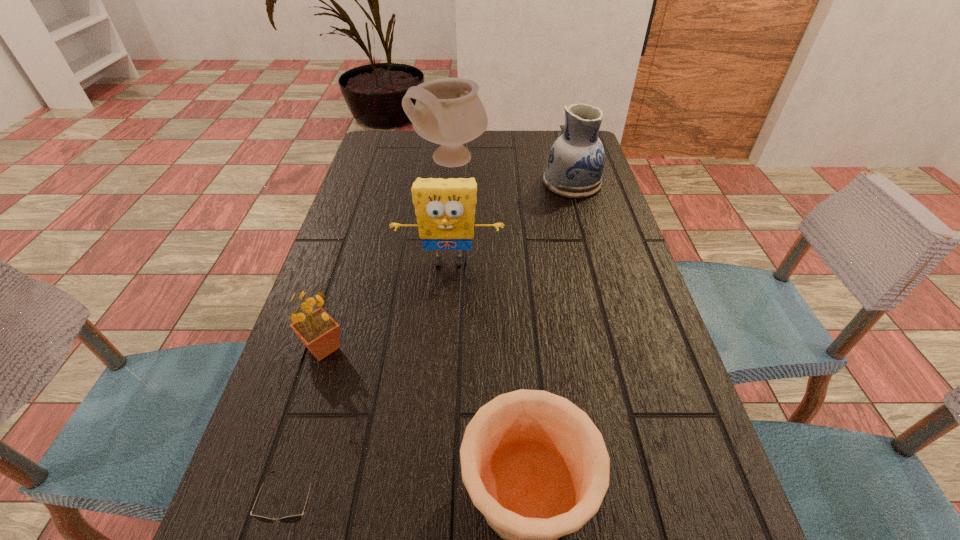
Find the location of a particular element. the tallest pottery is located at coordinates (448, 111).

I want to click on the second shortest pottery, so click(x=576, y=160).

In order to click on the rightmost object in this screenshot , I will do `click(576, 160)`.

This screenshot has height=540, width=960. I want to click on the third farthest object, so click(x=445, y=208).

This screenshot has width=960, height=540. In order to click on sunflower in this screenshot , I will do `click(320, 333)`.

The height and width of the screenshot is (540, 960). What are the coordinates of `the third nearest object` in the screenshot? It's located at (320, 333).

This screenshot has width=960, height=540. What are the coordinates of `the shortest object` in the screenshot? It's located at (291, 518).

Identify the location of free space located on the left of the tallest pottery. The image size is (960, 540). (385, 161).

Identify the location of vacant region located on the front of the rightmost object. This screenshot has width=960, height=540. (591, 254).

This screenshot has height=540, width=960. In order to click on free space located 0.280m on the face of the fourth nearest object in this screenshot , I will do `click(440, 384)`.